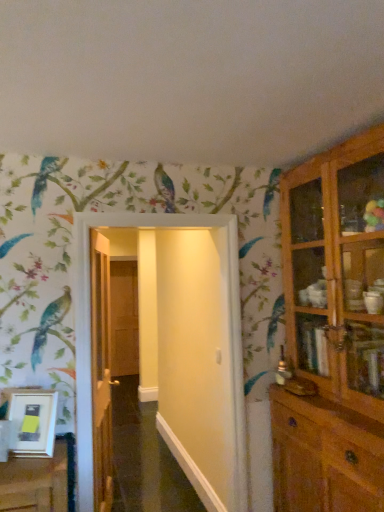
Describe the element at coordinates (124, 318) in the screenshot. I see `brown wooden door at center, the third door when ordered from front to back` at that location.

What is the approximate width of brown wooden door at center, arranged as the third door when viewed from the right?

The width of brown wooden door at center, arranged as the third door when viewed from the right, is 7.08 inches.

Measure the distance between point (227, 321) and camera.

Point (227, 321) and camera are 8.43 feet apart from each other.

Find the location of `wooden cabinet at right`. wooden cabinet at right is located at coordinates (335, 272).

What do you see at coordinates (335, 272) in the screenshot? The height and width of the screenshot is (512, 384). I see `wooden cabinet at right` at bounding box center [335, 272].

This screenshot has width=384, height=512. I want to click on brown wooden door at center, arranged as the third door when viewed from the right, so click(124, 318).

Is wooden door at center, the second door in the front-to-back sequence, positioned far away from wooden cabinet at right?

Absolutely, wooden door at center, the second door in the front-to-back sequence, is distant from wooden cabinet at right.

Which object is wider, wooden door at center, the second door in the right-to-left sequence, or wooden cabinet at right?

Wider between the two is wooden cabinet at right.

Is wooden door at center, the second door in the front-to-back sequence, taller or shorter than wooden cabinet at right?

Considering their sizes, wooden door at center, the second door in the front-to-back sequence, has less height than wooden cabinet at right.

Can you tell me how much wooden door at center, the second door in the front-to-back sequence, and wooden cabinet at right differ in facing direction?

The facing directions of wooden door at center, the second door in the front-to-back sequence, and wooden cabinet at right are 165 degrees apart.

From the image's perspective, would you say white matte picture frame at lower left is shown under wooden door at center, the second door in the front-to-back sequence?

Incorrect, from the image's perspective, white matte picture frame at lower left is higher than wooden door at center, the second door in the front-to-back sequence.

Is point (33, 414) less distant than point (107, 464)?

Yes, point (33, 414) is closer to viewer.

Is white matte picture frame at lower left not inside wooden door at center, the second door in the right-to-left sequence?

Yes, white matte picture frame at lower left is not within wooden door at center, the second door in the right-to-left sequence.

Looking at this image, from a real-world perspective, who is located lower, white matte picture frame at lower left or wooden door at center, the 2th door viewed from the back?

From a 3D spatial view, white matte picture frame at lower left is below.

Does brown wooden door at center, the 1th door in the left-to-right sequence, have a greater height compared to white matte picture frame at lower left?

Correct, brown wooden door at center, the 1th door in the left-to-right sequence, is much taller as white matte picture frame at lower left.

In the image, is brown wooden door at center, the third door when ordered from front to back, positioned in front of or behind white matte picture frame at lower left?

In the image, brown wooden door at center, the third door when ordered from front to back, appears behind white matte picture frame at lower left.

Does point (112, 325) come farther from viewer compared to point (21, 439)?

Yes, it is.

Which object is thinner, brown wooden door at center, the first door in the back-to-front sequence, or white matte picture frame at lower left?

Thinner between the two is white matte picture frame at lower left.

Based on the photo, from the image's perspective, which is below, wooden door at center, the second door in the front-to-back sequence, or white matte picture frame at lower left?

From the image's view, wooden door at center, the second door in the front-to-back sequence, is below.

Can you confirm if wooden door at center, the second door in the front-to-back sequence, is wider than white matte picture frame at lower left?

Yes.

Is wooden door at center, the second door in the right-to-left sequence, closer to camera compared to white matte picture frame at lower left?

No, wooden door at center, the second door in the right-to-left sequence, is further to the viewer.

Does wooden door at center, the second door in the front-to-back sequence, turn towards white matte picture frame at lower left?

No, wooden door at center, the second door in the front-to-back sequence, is not turned towards white matte picture frame at lower left.

Based on their sizes in the image, would you say white glossy door at center, the 3th door positioned from the left, is bigger or smaller than wooden cabinet at right?

In the image, white glossy door at center, the 3th door positioned from the left, appears to be smaller than wooden cabinet at right.

From a real-world perspective, is white glossy door at center, which appears as the 3th door when viewed from the back, under wooden cabinet at right?

Yes, from a real-world perspective, white glossy door at center, which appears as the 3th door when viewed from the back, is beneath wooden cabinet at right.

Is white glossy door at center, the first door viewed from the right, placed right next to wooden cabinet at right?

They are not placed beside each other.

Between white glossy door at center, the 3th door positioned from the left, and brown wooden door at center, the 1th door in the left-to-right sequence, which one appears on the right side from the viewer's perspective?

Positioned to the right is white glossy door at center, the 3th door positioned from the left.

This screenshot has width=384, height=512. I want to click on door that is the 2nd one when counting downward from the white glossy door at center, the first door viewed from the right (from the image's perspective), so click(124, 318).

Looking at this image, measure the distance from white glossy door at center, which appears as the 3th door when viewed from the back, to brown wooden door at center, arranged as the third door when viewed from the right.

white glossy door at center, which appears as the 3th door when viewed from the back, is 2.71 meters away from brown wooden door at center, arranged as the third door when viewed from the right.

Is point (187, 403) closer or farther from the camera than point (133, 358)?

Point (187, 403) is positioned closer to the camera compared to point (133, 358).

Which is in front, wooden cabinet at right or white matte picture frame at lower left?

wooden cabinet at right.

From the image's perspective, is wooden cabinet at right on top of white matte picture frame at lower left?

Yes.

From the picture: Between wooden cabinet at right and white matte picture frame at lower left, which one has smaller width?

Thinner between the two is white matte picture frame at lower left.

Consider the image. From a real-world perspective, is wooden cabinet at right on top of white matte picture frame at lower left?

Correct, in the physical world, wooden cabinet at right is higher than white matte picture frame at lower left.

At what (x,y) coordinates should I click in order to perform the action: click on cupboard lying in front of the wooden door at center, which ranks as the 2th door in left-to-right order. Please return your answer as a coordinate pair (x, y). This screenshot has height=512, width=384. Looking at the image, I should click on (335, 272).

Find the location of a particular element. The height and width of the screenshot is (512, 384). picture frame that appears above the wooden door at center, the second door in the right-to-left sequence (from the image's perspective) is located at coordinates click(32, 422).

Based on their spatial positions, is white glossy door at center, which appears as the 3th door when viewed from the back, or wooden cabinet at right closer to white matte picture frame at lower left?

white glossy door at center, which appears as the 3th door when viewed from the back, is closer to white matte picture frame at lower left.

Estimate the real-world distances between objects in this image. Which object is closer to brown wooden door at center, the 1th door in the left-to-right sequence, white glossy door at center, the 3th door positioned from the left, or wooden cabinet at right?

white glossy door at center, the 3th door positioned from the left, is positioned closer to the anchor brown wooden door at center, the 1th door in the left-to-right sequence.

Looking at this image, based on their spatial positions, is white glossy door at center, the 1th door viewed from the front, or wooden door at center, which ranks as the 2th door in left-to-right order, closer to white matte picture frame at lower left?

wooden door at center, which ranks as the 2th door in left-to-right order, is closer to white matte picture frame at lower left.

Considering their positions, is wooden cabinet at right positioned further to brown wooden door at center, the third door when ordered from front to back, than white glossy door at center, which appears as the 3th door when viewed from the back?

The object further to brown wooden door at center, the third door when ordered from front to back, is wooden cabinet at right.

From the image, which object appears to be nearer to white matte picture frame at lower left, wooden door at center, the second door in the front-to-back sequence, or wooden cabinet at right?

Among the two, wooden door at center, the second door in the front-to-back sequence, is located nearer to white matte picture frame at lower left.

Looking at the image, which one is located closer to brown wooden door at center, the 1th door in the left-to-right sequence, wooden cabinet at right or white matte picture frame at lower left?

The object closer to brown wooden door at center, the 1th door in the left-to-right sequence, is white matte picture frame at lower left.

Which object lies further to the anchor point wooden cabinet at right, wooden door at center, the second door in the right-to-left sequence, or white matte picture frame at lower left?

Among the two, white matte picture frame at lower left is located further to wooden cabinet at right.

Estimate the real-world distances between objects in this image. Which object is closer to brown wooden door at center, the third door when ordered from front to back, white glossy door at center, the 1th door viewed from the front, or white matte picture frame at lower left?

Based on the image, white glossy door at center, the 1th door viewed from the front, appears to be nearer to brown wooden door at center, the third door when ordered from front to back.

Find the location of a particular element. The image size is (384, 512). door located between white matte picture frame at lower left and white glossy door at center, the 1th door viewed from the front, in the left-right direction is located at coordinates (101, 372).

Identify the location of door located between wooden door at center, which ranks as the 2th door in left-to-right order, and wooden cabinet at right in the left-right direction. The width and height of the screenshot is (384, 512). (175, 345).

What are the coordinates of `picture frame between wooden cabinet at right and brown wooden door at center, arranged as the third door when viewed from the right, in the front-back direction` in the screenshot? It's located at [x=32, y=422].

Identify the location of door positioned between white glossy door at center, the 1th door viewed from the front, and brown wooden door at center, the 1th door in the left-to-right sequence, from near to far. The height and width of the screenshot is (512, 384). (101, 372).